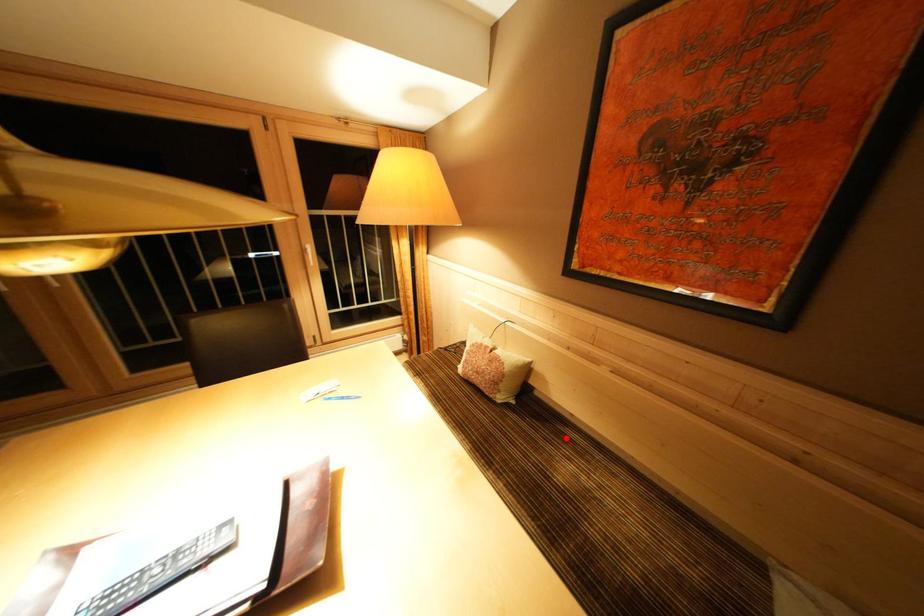
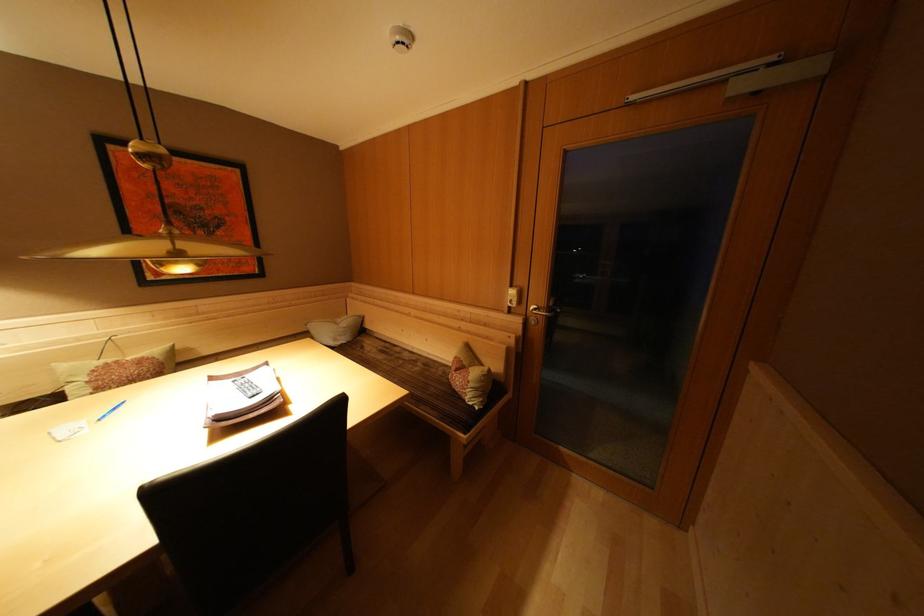
Question: I am providing you with two images of the same scene from different viewpoints. A red point is marked on the first image. Is the red point's position out of view in image 2?

Choices:
 (A) Yes
 (B) No

Answer: (A)